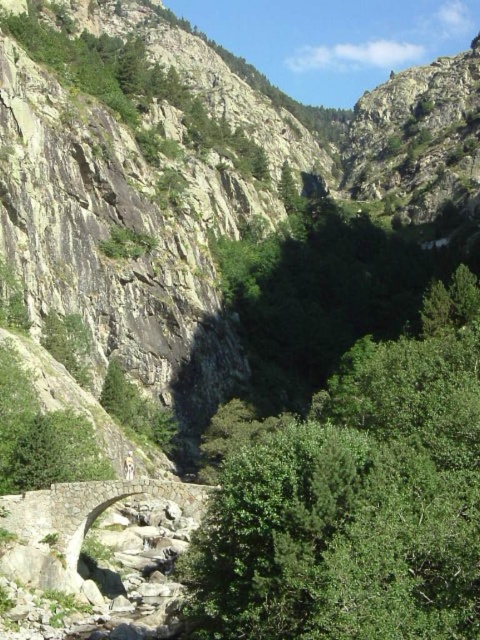
Can you confirm if green leafy tree at center is positioned to the left of stone bridge at center?

Incorrect, green leafy tree at center is not on the left side of stone bridge at center.

Between point (423, 397) and point (96, 509), which one is positioned behind?

Positioned behind is point (96, 509).

The image size is (480, 640). In order to click on green leafy tree at center in this screenshot , I will do `click(357, 499)`.